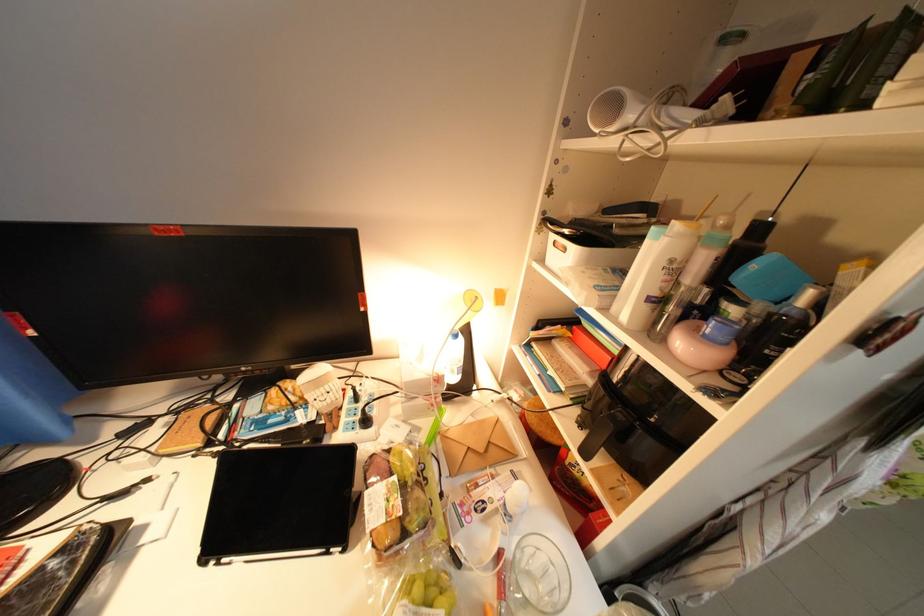
The width and height of the screenshot is (924, 616). In order to click on pink container lid in this screenshot , I will do `click(704, 342)`.